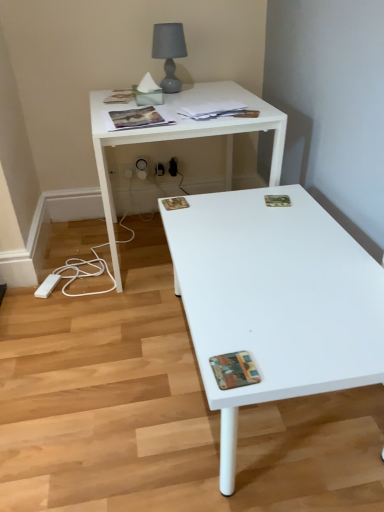
Question: From the image's perspective, is matte paper magazine at upper center, which ranks as the 3th magazine in back-to-front order, on top of camouflage paper magazine at upper right, the 2th magazine in the back-to-front sequence?

Choices:
 (A) yes
 (B) no

Answer: (A)

Question: From the image's perspective, is matte paper magazine at upper center, which ranks as the 3th magazine in back-to-front order, located beneath camouflage paper magazine at upper right, the fourth magazine in the top-to-bottom sequence?

Choices:
 (A) yes
 (B) no

Answer: (B)

Question: Does matte paper magazine at upper center, which ranks as the 3th magazine in back-to-front order, appear on the left side of camouflage paper magazine at upper right, the 5th magazine positioned from the front?

Choices:
 (A) no
 (B) yes

Answer: (B)

Question: Can you confirm if matte paper magazine at upper center, the fifth magazine ordered from the bottom, is thinner than camouflage paper magazine at upper right, the 3th magazine ordered from the bottom?

Choices:
 (A) no
 (B) yes

Answer: (A)

Question: Is camouflage paper magazine at upper right, the 5th magazine positioned from the front, located within matte paper magazine at upper center, the 2th magazine viewed from the top?

Choices:
 (A) yes
 (B) no

Answer: (B)

Question: In the image, is printed paper magazine at upper center, which appears as the second magazine when viewed from the front, on the left side or the right side of printed paper magazine at center, which is counted as the fourth magazine, starting from the back?

Choices:
 (A) right
 (B) left

Answer: (B)

Question: Relative to printed paper magazine at center, marked as the second magazine in a bottom-to-top arrangement, is printed paper magazine at upper center, the 5th magazine when ordered from back to front, in front or behind?

Choices:
 (A) front
 (B) behind

Answer: (A)

Question: From a real-world perspective, is printed paper magazine at upper center, which is counted as the fourth magazine, starting from the bottom, above or below printed paper magazine at center, marked as the second magazine in a bottom-to-top arrangement?

Choices:
 (A) above
 (B) below

Answer: (A)

Question: Considering the positions of point (132, 118) and point (188, 203), is point (132, 118) closer or farther from the camera than point (188, 203)?

Choices:
 (A) farther
 (B) closer

Answer: (A)

Question: Based on their sizes in the image, would you say printed paper magazine at upper center, which is counted as the fourth magazine, starting from the bottom, is bigger or smaller than multicolored textured magazine at lower right, acting as the first magazine starting from the front?

Choices:
 (A) big
 (B) small

Answer: (A)

Question: Considering the relative positions of printed paper magazine at upper center, which appears as the second magazine when viewed from the front, and multicolored textured magazine at lower right, acting as the first magazine starting from the front, in the image provided, is printed paper magazine at upper center, which appears as the second magazine when viewed from the front, to the left or to the right of multicolored textured magazine at lower right, acting as the first magazine starting from the front,?

Choices:
 (A) left
 (B) right

Answer: (A)

Question: Is printed paper magazine at upper center, the 5th magazine when ordered from back to front, inside or outside of multicolored textured magazine at lower right, acting as the first magazine starting from the front?

Choices:
 (A) outside
 (B) inside

Answer: (A)

Question: Considering the positions of point (150, 122) and point (221, 357), is point (150, 122) closer or farther from the camera than point (221, 357)?

Choices:
 (A) closer
 (B) farther

Answer: (B)

Question: Choose the correct answer: Is white plastic electric outlet at lower center, the 2th electric outlet positioned from the left, inside matte paper magazine at upper left, acting as the sixth magazine starting from the bottom, or outside it?

Choices:
 (A) inside
 (B) outside

Answer: (B)

Question: From the image's perspective, is white plastic electric outlet at lower center, the 2th electric outlet positioned from the left, located above or below matte paper magazine at upper left, marked as the 1th magazine in a top-to-bottom arrangement?

Choices:
 (A) above
 (B) below

Answer: (B)